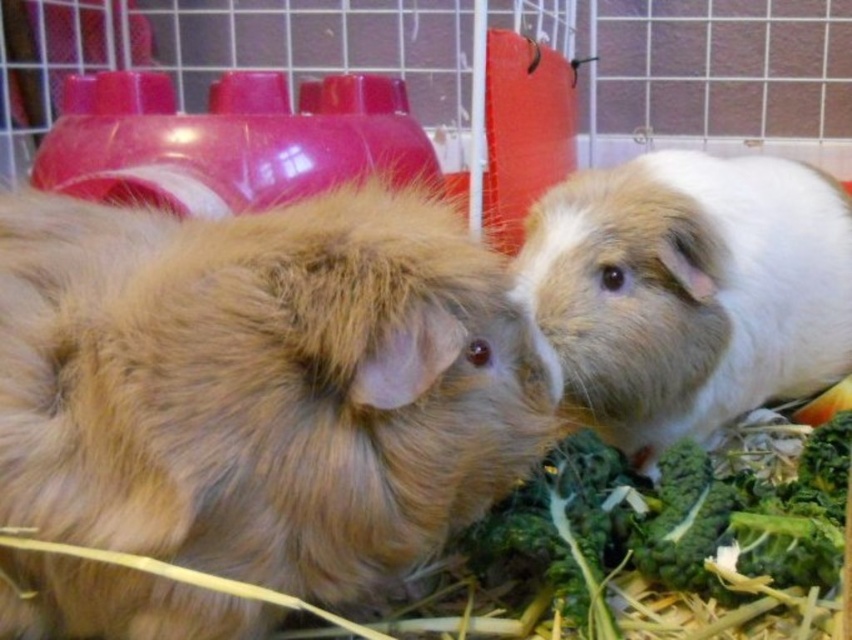
Question: Based on their relative distances, which object is farther from the white soft hamster at center?

Choices:
 (A) green leafy broccoli at lower right
 (B) fuzzy brown hamster at center

Answer: (B)

Question: Does fuzzy brown hamster at center have a smaller size compared to white soft hamster at center?

Choices:
 (A) no
 (B) yes

Answer: (B)

Question: Is fuzzy brown hamster at center above green leafy broccoli at lower right?

Choices:
 (A) no
 (B) yes

Answer: (B)

Question: Can you confirm if white soft hamster at center is positioned below green leafy broccoli at lower right?

Choices:
 (A) no
 (B) yes

Answer: (A)

Question: Which point is closer to the camera?

Choices:
 (A) (659, 556)
 (B) (721, 177)
 (C) (252, 433)

Answer: (C)

Question: Which point appears closest to the camera in this image?

Choices:
 (A) (697, 477)
 (B) (642, 177)

Answer: (A)